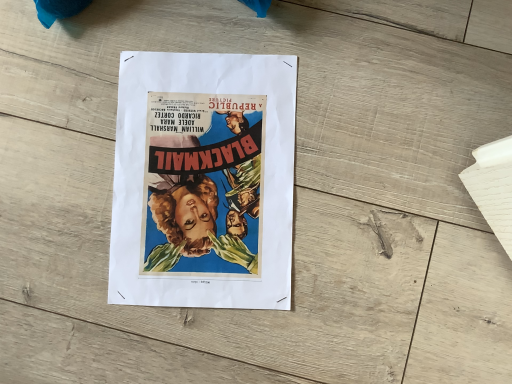
Find the location of a particular element. The height and width of the screenshot is (384, 512). matte paper poster at center is located at coordinates (203, 181).

The height and width of the screenshot is (384, 512). What do you see at coordinates (203, 181) in the screenshot? I see `matte paper poster at center` at bounding box center [203, 181].

The height and width of the screenshot is (384, 512). In order to click on matte paper poster at center in this screenshot , I will do `click(203, 181)`.